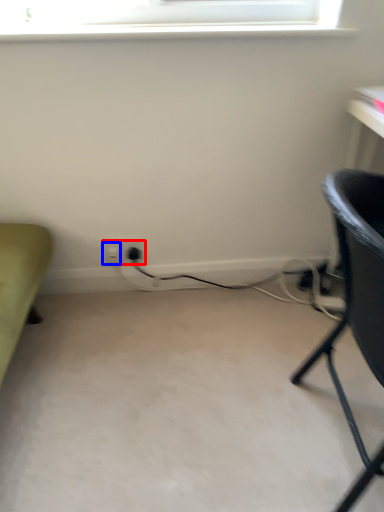
Question: Which object is further to the camera taking this photo, electric outlet (highlighted by a red box) or electric outlet (highlighted by a blue box)?

Choices:
 (A) electric outlet
 (B) electric outlet

Answer: (B)